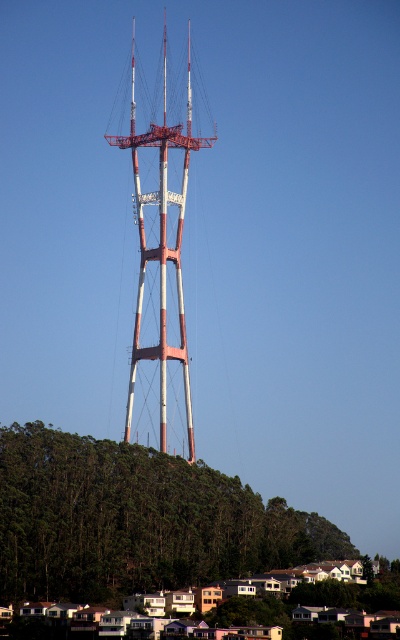
Question: Which point is closer to the camera?

Choices:
 (A) metallic red and white tower at center
 (B) green leafy hillside at lower left

Answer: (B)

Question: Among these points, which one is nearest to the camera?

Choices:
 (A) (129, 406)
 (B) (285, 522)

Answer: (B)

Question: Among these points, which one is farthest from the camera?

Choices:
 (A) (188, 64)
 (B) (136, 516)

Answer: (A)

Question: Can you confirm if green leafy hillside at lower left is positioned above metallic red and white tower at center?

Choices:
 (A) no
 (B) yes

Answer: (A)

Question: From the image, what is the correct spatial relationship of green leafy hillside at lower left in relation to metallic red and white tower at center?

Choices:
 (A) above
 (B) below

Answer: (B)

Question: In this image, where is green leafy hillside at lower left located relative to metallic red and white tower at center?

Choices:
 (A) above
 (B) below

Answer: (B)